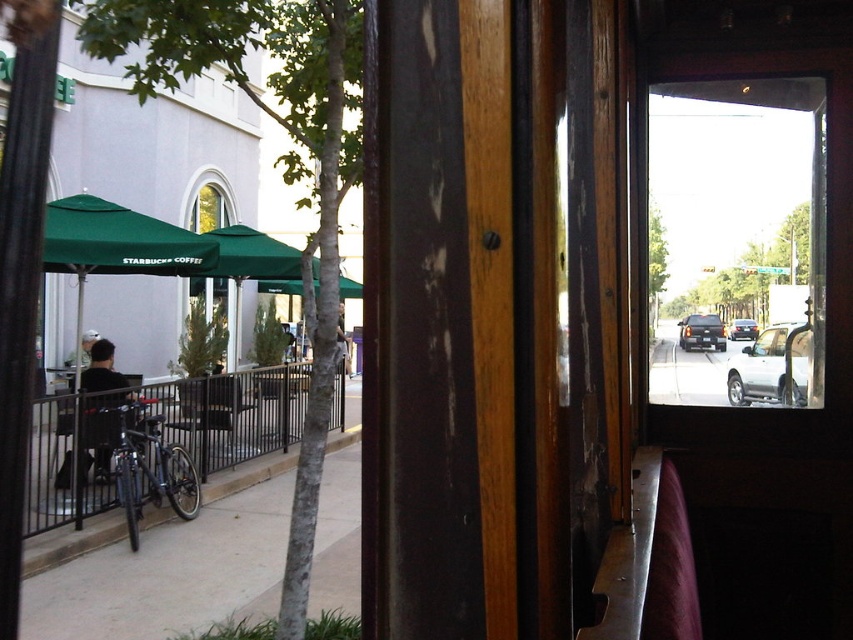
Question: Estimate the real-world distances between objects in this image. Which object is closer to the green fabric umbrella at left?

Choices:
 (A) silver metallic sedan at center
 (B) green fabric umbrella at upper left
 (C) dark gray shirt at center
 (D) dark gray metallic suv at center

Answer: (C)

Question: Does green fabric umbrella at upper left appear on the left side of green fabric umbrella at center?

Choices:
 (A) yes
 (B) no

Answer: (A)

Question: Which point is farther to the camera?

Choices:
 (A) gray concrete sidewalk at lower left
 (B) silver metallic sedan at center
 (C) transparent glass door at center

Answer: (A)

Question: Is silver metallic sedan at center above green fabric umbrella at center?

Choices:
 (A) yes
 (B) no

Answer: (B)

Question: Among these objects, which one is farthest from the camera?

Choices:
 (A) dark brown leather jacket at center
 (B) dark gray metallic suv at center

Answer: (A)

Question: Can you confirm if gray concrete sidewalk at lower left is positioned below silver metallic sedan at center?

Choices:
 (A) no
 (B) yes

Answer: (B)